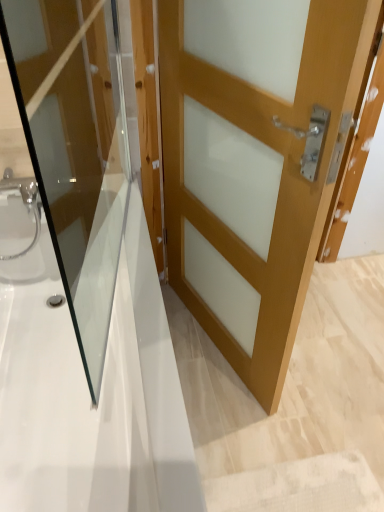
Question: Is white glossy bathtub at center taller than light brown wood door at center, the first door in the right-to-left sequence?

Choices:
 (A) yes
 (B) no

Answer: (B)

Question: From the image's perspective, would you say white glossy bathtub at center is shown under light brown wood door at center, which ranks as the 2th door in left-to-right order?

Choices:
 (A) yes
 (B) no

Answer: (A)

Question: Is the position of white glossy bathtub at center less distant than that of light brown wood door at center, the first door in the right-to-left sequence?

Choices:
 (A) yes
 (B) no

Answer: (A)

Question: Are white glossy bathtub at center and light brown wood door at center, which ranks as the 2th door in left-to-right order, beside each other?

Choices:
 (A) no
 (B) yes

Answer: (A)

Question: Would you say light brown wood door at center, the first door in the right-to-left sequence, is part of white glossy bathtub at center's contents?

Choices:
 (A) yes
 (B) no

Answer: (B)

Question: Considering the relative sizes of white glossy bathtub at center and light brown wood door at center, which ranks as the 2th door in left-to-right order, in the image provided, is white glossy bathtub at center smaller than light brown wood door at center, which ranks as the 2th door in left-to-right order,?

Choices:
 (A) no
 (B) yes

Answer: (A)

Question: Is light brown wood door at center, the first door in the right-to-left sequence, shorter than white glossy bathtub at center?

Choices:
 (A) no
 (B) yes

Answer: (A)

Question: Is light brown wood door at center, the first door in the right-to-left sequence, located outside white glossy bathtub at center?

Choices:
 (A) no
 (B) yes

Answer: (B)

Question: From the image's perspective, is light brown wood door at center, which ranks as the 2th door in left-to-right order, beneath white glossy bathtub at center?

Choices:
 (A) no
 (B) yes

Answer: (A)

Question: From a real-world perspective, is light brown wood door at center, the first door in the right-to-left sequence, on top of white glossy bathtub at center?

Choices:
 (A) yes
 (B) no

Answer: (A)

Question: From the image's perspective, is light brown wood door at center, the first door in the right-to-left sequence, on top of white glossy bathtub at center?

Choices:
 (A) yes
 (B) no

Answer: (A)

Question: Does light brown wood door at center, which ranks as the 2th door in left-to-right order, appear on the right side of white glossy bathtub at center?

Choices:
 (A) yes
 (B) no

Answer: (A)

Question: Can you confirm if matte wood door at center, which appears as the second door when viewed from the right, is shorter than light brown wood door at center, the first door in the right-to-left sequence?

Choices:
 (A) yes
 (B) no

Answer: (A)